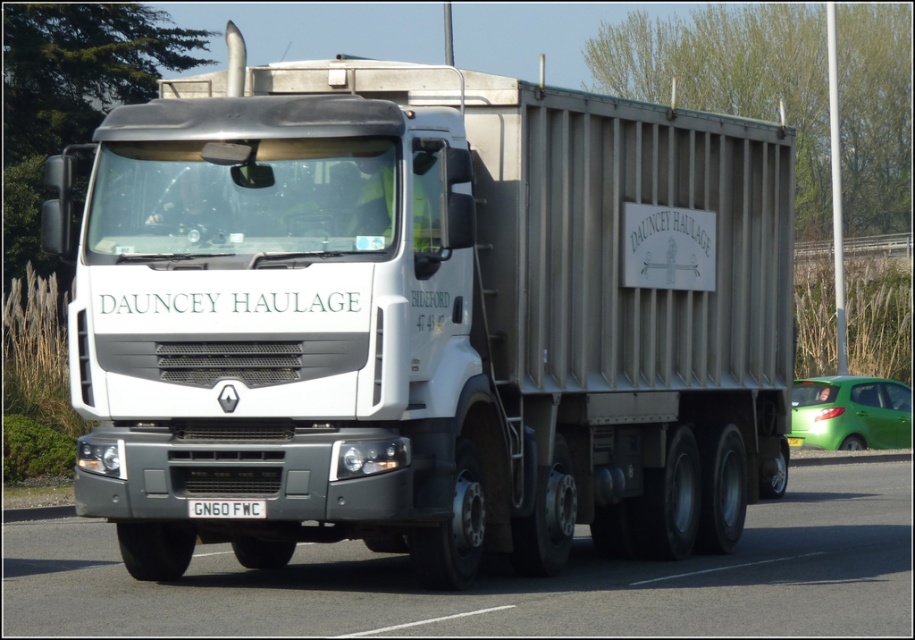
Who is higher up, white matte truck at center or gray asphalt highway at center?

Positioned higher is white matte truck at center.

Where is `white matte truck at center`? Image resolution: width=915 pixels, height=640 pixels. white matte truck at center is located at coordinates (429, 317).

What are the coordinates of `white matte truck at center` in the screenshot? It's located at (429, 317).

Does green matte hatchback at right appear on the right side of white metallic license plate at center?

Correct, you'll find green matte hatchback at right to the right of white metallic license plate at center.

Between green matte hatchback at right and white metallic license plate at center, which one has more height?

green matte hatchback at right

The image size is (915, 640). What do you see at coordinates (849, 413) in the screenshot? I see `green matte hatchback at right` at bounding box center [849, 413].

At what (x,y) coordinates should I click in order to perform the action: click on green matte hatchback at right. Please return your answer as a coordinate pair (x, y). This screenshot has width=915, height=640. Looking at the image, I should click on (849, 413).

Who is more forward, [634,188] or [246,515]?

Point [246,515] is in front.

Does white matte truck at center have a larger size compared to white metallic license plate at center?

Indeed, white matte truck at center has a larger size compared to white metallic license plate at center.

Between point (291, 416) and point (194, 500), which one is positioned in front?

Point (291, 416) is more forward.

Where is `white matte truck at center`? The height and width of the screenshot is (640, 915). white matte truck at center is located at coordinates (429, 317).